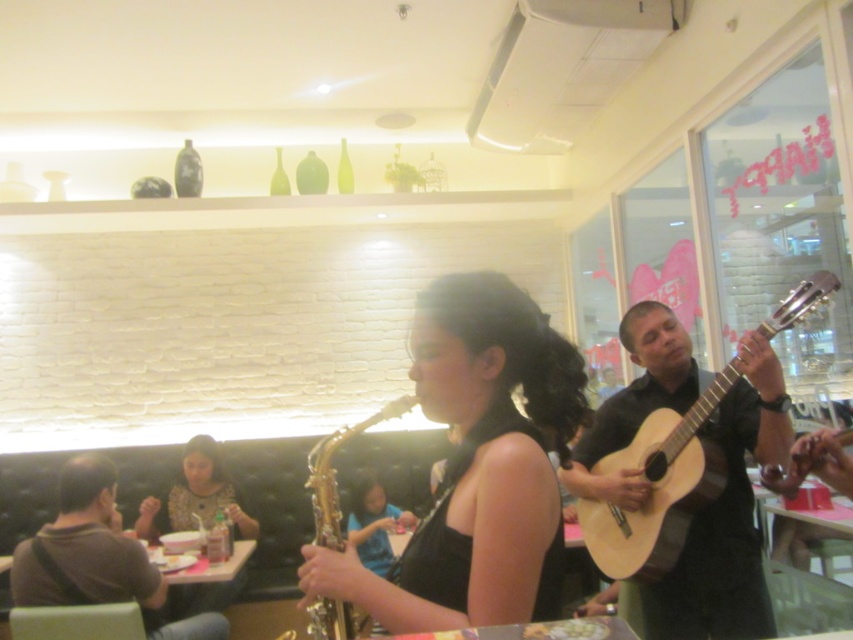
You are a photographer trying to capture a photo of the gold shiny saxophone at center and the brown fabric shirt at lower left in the same frame. The camera can focus on objects within a 2.5 meter range. Will both objects be in focus?

The gold shiny saxophone at center is 2.02 meters away from the brown fabric shirt at lower left. Since the camera can focus within a 2.5 meter range, both objects are within the required distance and will be in focus.